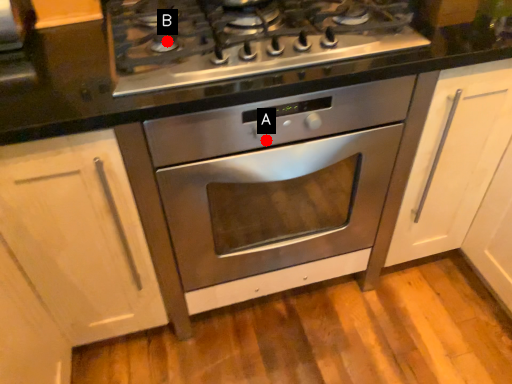
Question: Two points are circled on the image, labeled by A and B beside each circle. Among these points, which one is farthest from the camera?

Choices:
 (A) A is further
 (B) B is further

Answer: (A)